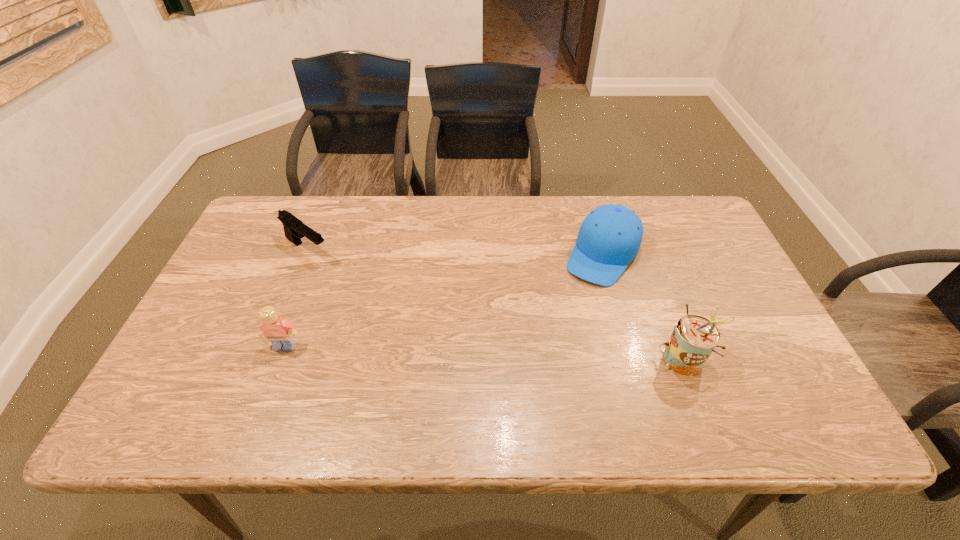
At what (x,y) coordinates should I click in order to perform the action: click on free space at the right edge of the desktop. Please return your answer as a coordinate pair (x, y). Looking at the image, I should click on (710, 319).

Where is `blank space at the far right corner of the desktop`? This screenshot has height=540, width=960. blank space at the far right corner of the desktop is located at coordinates (665, 225).

The image size is (960, 540). What are the coordinates of `vacant region between the pistol and the cap` in the screenshot? It's located at (455, 252).

This screenshot has width=960, height=540. I want to click on free space between the Lego and the tallest object, so click(x=485, y=352).

Locate an element on the screen. Image resolution: width=960 pixels, height=540 pixels. free space that is in between the Lego and the cap is located at coordinates (444, 300).

Where is `vacant area that lies between the can and the cap`? vacant area that lies between the can and the cap is located at coordinates (643, 306).

What are the coordinates of `free space between the Lego and the tallest object` in the screenshot? It's located at (485, 352).

The image size is (960, 540). I want to click on empty space between the Lego and the pistol, so click(x=296, y=298).

This screenshot has height=540, width=960. In order to click on vacant area that lies between the Lego and the tallest object in this screenshot , I will do `click(485, 352)`.

Find the location of a particular element. This screenshot has width=960, height=540. free space that is in between the cap and the pistol is located at coordinates (455, 252).